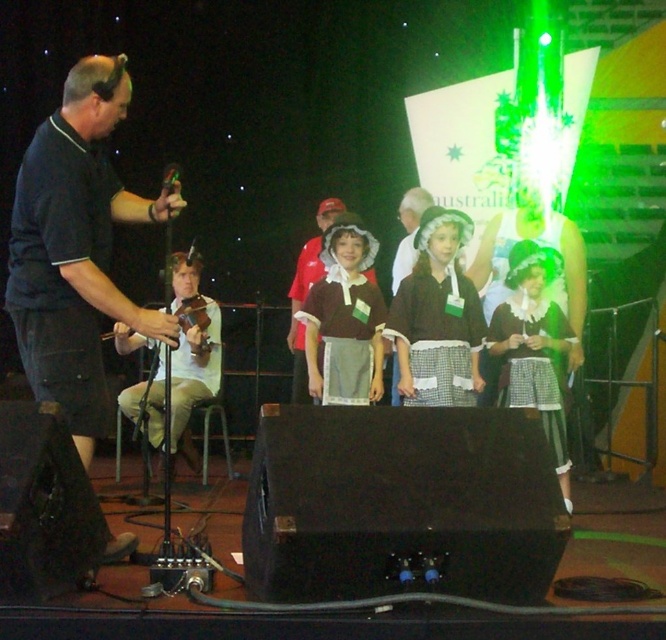
Question: Does matte brown dress at center appear on the right side of light brown wood violin at left?

Choices:
 (A) yes
 (B) no

Answer: (A)

Question: In this image, where is dark blue shirt at left located relative to matte brown dress at center?

Choices:
 (A) left
 (B) right

Answer: (A)

Question: Which object is positioned farthest from the matte black dress at center?

Choices:
 (A) white checkered dress at center
 (B) light brown wood violin at left
 (C) matte brown dress at center

Answer: (B)

Question: Considering the real-world distances, which object is farthest from the matte brown dress at center?

Choices:
 (A) white checkered dress at center
 (B) dark blue shirt at left

Answer: (B)

Question: Does matte black dress at center appear on the left side of white checkered dress at center?

Choices:
 (A) yes
 (B) no

Answer: (A)

Question: Among these points, which one is nearest to the camera?

Choices:
 (A) (204, 369)
 (B) (366, 305)

Answer: (B)